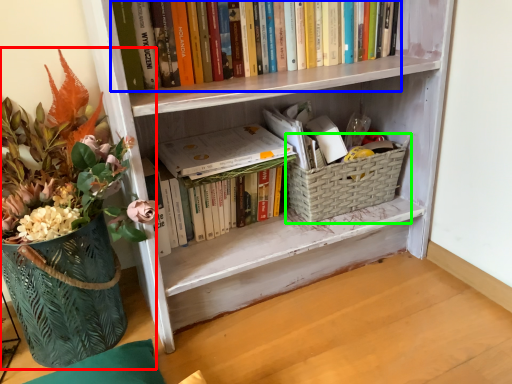
Question: Estimate the real-world distances between objects in this image. Which object is farther from houseplant (highlighted by a red box), book (highlighted by a blue box) or basket container (highlighted by a green box)?

Choices:
 (A) book
 (B) basket container

Answer: (B)